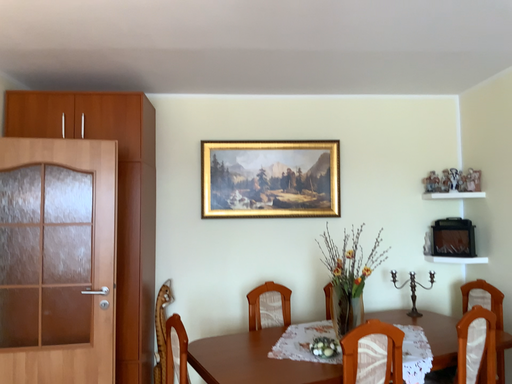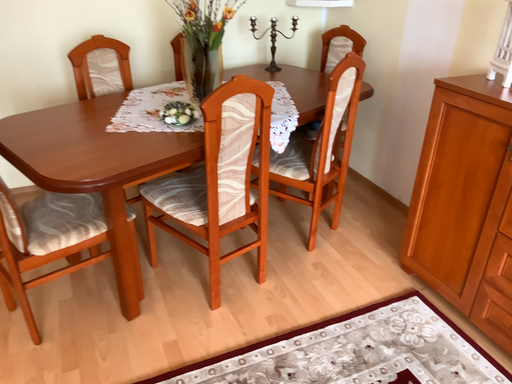
Question: Which way did the camera rotate in the video?

Choices:
 (A) rotated right
 (B) rotated left

Answer: (A)